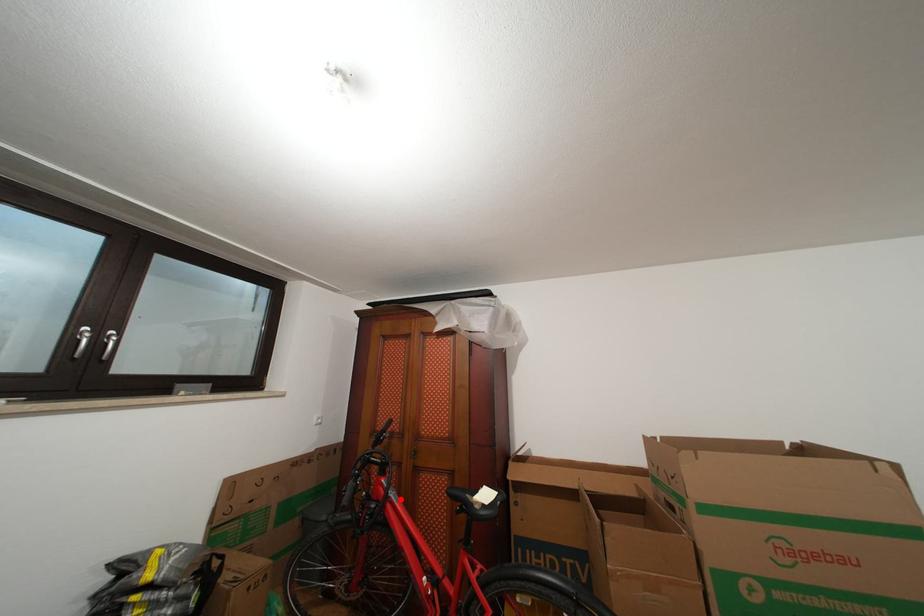
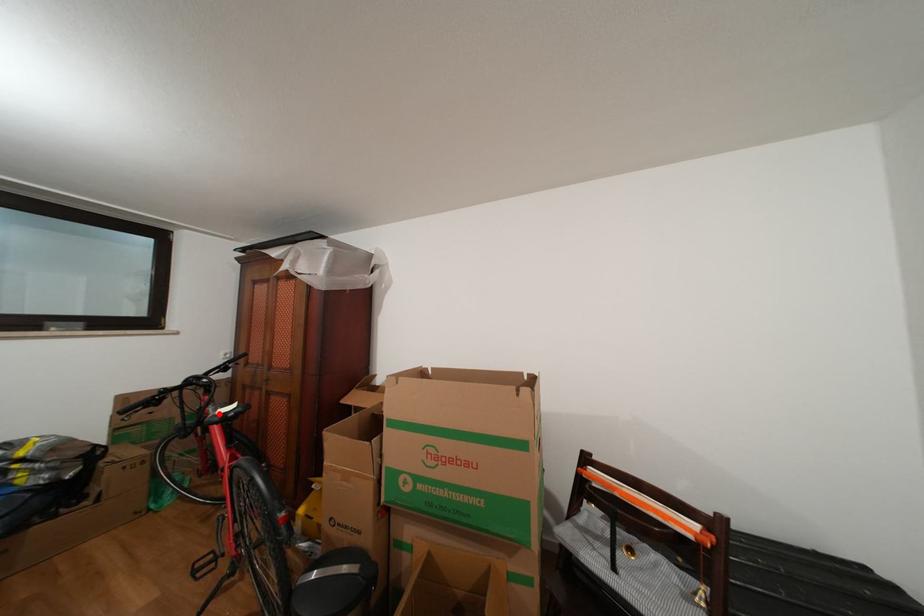
I am providing you with two images of the same scene from different viewpoints. A red point is marked on the first image and another point is marked on the second image. Are the points marked in image1 and image2 representing the same 3D position?

Yes